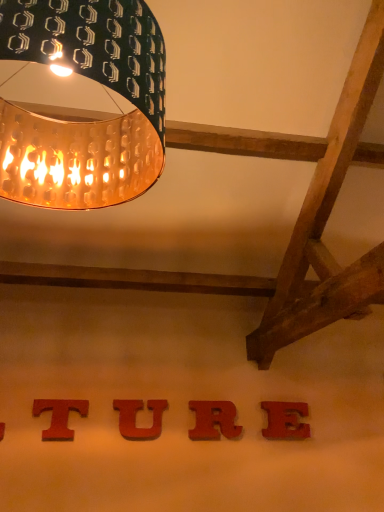
Question: Does red matte letter r at center, which is counted as the second alphabet, starting from the right, lie in front of red matte letter e at center, the 4th alphabet viewed from the left?

Choices:
 (A) yes
 (B) no

Answer: (A)

Question: Does red matte letter r at center, which is counted as the second alphabet, starting from the right, have a smaller size compared to red matte letter e at center, marked as the first alphabet in a right-to-left arrangement?

Choices:
 (A) yes
 (B) no

Answer: (B)

Question: From a real-world perspective, is red matte letter r at center, which ranks as the third alphabet in left-to-right order, under red matte letter e at center, marked as the first alphabet in a right-to-left arrangement?

Choices:
 (A) yes
 (B) no

Answer: (B)

Question: Does red matte letter r at center, which is counted as the second alphabet, starting from the right, appear on the right side of red matte letter e at center, marked as the first alphabet in a right-to-left arrangement?

Choices:
 (A) no
 (B) yes

Answer: (A)

Question: Is red matte letter r at center, which ranks as the third alphabet in left-to-right order, bigger than red matte letter e at center, the 4th alphabet viewed from the left?

Choices:
 (A) no
 (B) yes

Answer: (B)

Question: Would you say red matte letter e at center, the 4th alphabet viewed from the left, is inside or outside red wood letter t at lower center, placed as the 1th alphabet when sorted from left to right?

Choices:
 (A) inside
 (B) outside

Answer: (B)

Question: Is point (306, 406) positioned closer to the camera than point (52, 437)?

Choices:
 (A) closer
 (B) farther

Answer: (B)

Question: Is red matte letter e at center, marked as the first alphabet in a right-to-left arrangement, wider or thinner than red wood letter t at lower center, placed as the fourth alphabet when sorted from right to left?

Choices:
 (A) thin
 (B) wide

Answer: (B)

Question: From their relative heights in the image, would you say red matte letter e at center, the 4th alphabet viewed from the left, is taller or shorter than red wood letter t at lower center, placed as the fourth alphabet when sorted from right to left?

Choices:
 (A) short
 (B) tall

Answer: (B)

Question: Considering their positions, is red wood u at center, the second alphabet in the left-to-right sequence, located in front of or behind gold perforated lampshade at upper left?

Choices:
 (A) behind
 (B) front

Answer: (A)

Question: From the image's perspective, is red wood u at center, placed as the 3th alphabet when sorted from right to left, located above or below gold perforated lampshade at upper left?

Choices:
 (A) below
 (B) above

Answer: (A)

Question: Is red wood u at center, placed as the 3th alphabet when sorted from right to left, situated inside gold perforated lampshade at upper left or outside?

Choices:
 (A) inside
 (B) outside

Answer: (B)

Question: Considering the positions of point (157, 415) and point (19, 133), is point (157, 415) closer or farther from the camera than point (19, 133)?

Choices:
 (A) closer
 (B) farther

Answer: (B)

Question: Is red matte letter r at center, which ranks as the third alphabet in left-to-right order, taller or shorter than red wood u at center, placed as the 3th alphabet when sorted from right to left?

Choices:
 (A) short
 (B) tall

Answer: (B)

Question: Is red matte letter r at center, which ranks as the third alphabet in left-to-right order, to the left or to the right of red wood u at center, placed as the 3th alphabet when sorted from right to left, in the image?

Choices:
 (A) left
 (B) right

Answer: (B)